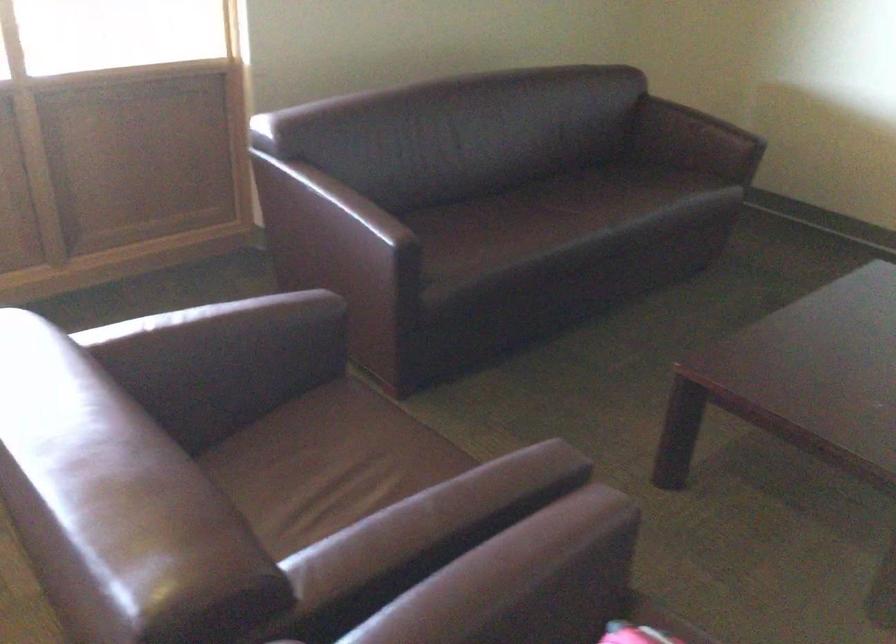
What do you see at coordinates (328, 464) in the screenshot? The image size is (896, 644). I see `the sofa surface` at bounding box center [328, 464].